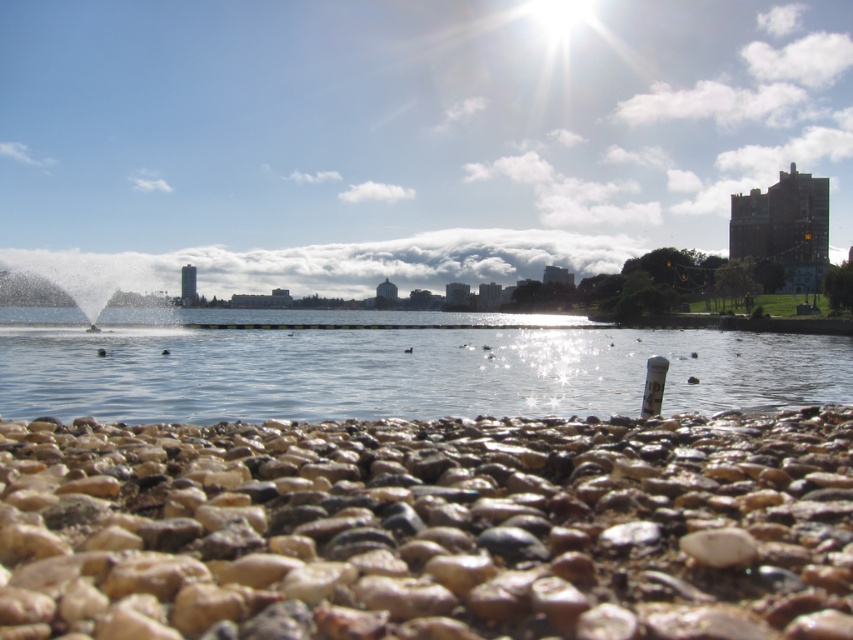
You are standing on the brown pebbles at lower center and want to reach the clear water at center. Which direction should you move to get there?

You should move upward because the brown pebbles at lower center is located below the clear water at center.

You are standing on the brown pebbles at lower center and want to reach the clear water at center. Based on the scene, which area covers a larger portion of the image?

The clear water at center occupies a larger portion of the image than the brown pebbles at lower center.

You are standing at the center of the image and want to place a small marker at the exact center of the brown pebbles at lower center. What are the coordinates where you should place the marker?

The coordinates for the exact center of the brown pebbles at lower center are at point (428, 529).